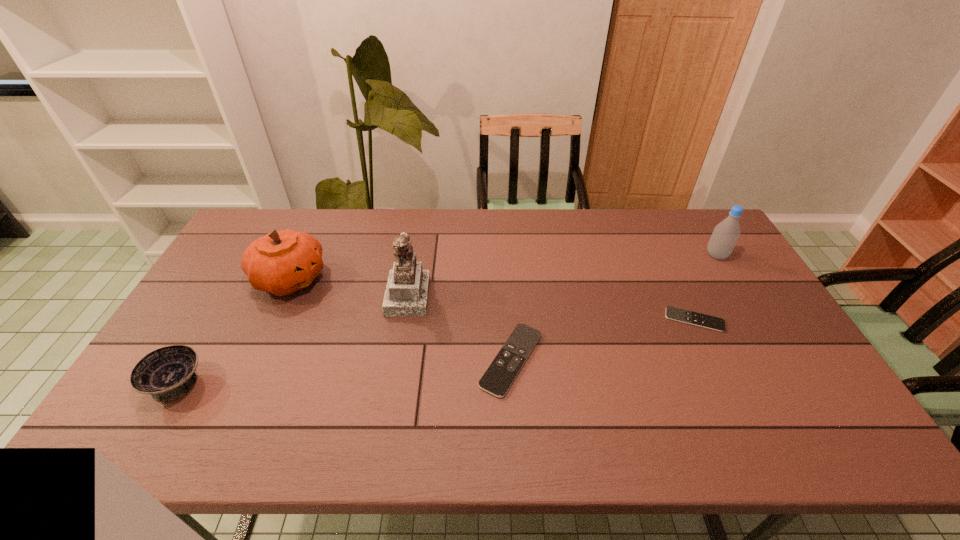
Image resolution: width=960 pixels, height=540 pixels. I want to click on object that stands as the closest to the bowl, so click(283, 262).

Where is `free region that satisfies the following two spatial constraints: 1. on the front-facing side of the figurine; 2. on the front side of the bowl`? The image size is (960, 540). free region that satisfies the following two spatial constraints: 1. on the front-facing side of the figurine; 2. on the front side of the bowl is located at coordinates (393, 383).

Where is `blank area in the image that satisfies the following two spatial constraints: 1. on the front-facing side of the taller remote control; 2. on the left side of the pumpkin`? This screenshot has height=540, width=960. blank area in the image that satisfies the following two spatial constraints: 1. on the front-facing side of the taller remote control; 2. on the left side of the pumpkin is located at coordinates (252, 360).

At what (x,y) coordinates should I click in order to perform the action: click on free space that satisfies the following two spatial constraints: 1. on the front-facing side of the pumpkin; 2. on the right side of the taller remote control. Please return your answer as a coordinate pair (x, y). This screenshot has width=960, height=540. Looking at the image, I should click on (252, 360).

Identify the location of vacant space that satisfies the following two spatial constraints: 1. on the front-facing side of the pumpkin; 2. on the left side of the third object from right to left. (252, 360).

Where is `vacant space that satisfies the following two spatial constraints: 1. on the back side of the left remote control; 2. on the left side of the rightmost object`? The height and width of the screenshot is (540, 960). vacant space that satisfies the following two spatial constraints: 1. on the back side of the left remote control; 2. on the left side of the rightmost object is located at coordinates (505, 255).

Locate an element on the screen. vacant point that satisfies the following two spatial constraints: 1. on the front-facing side of the tallest object; 2. on the back side of the second shortest object is located at coordinates (396, 360).

Locate an element on the screen. Image resolution: width=960 pixels, height=540 pixels. free point that satisfies the following two spatial constraints: 1. on the back side of the rightmost object; 2. on the right side of the fourth object from left to right is located at coordinates (505, 255).